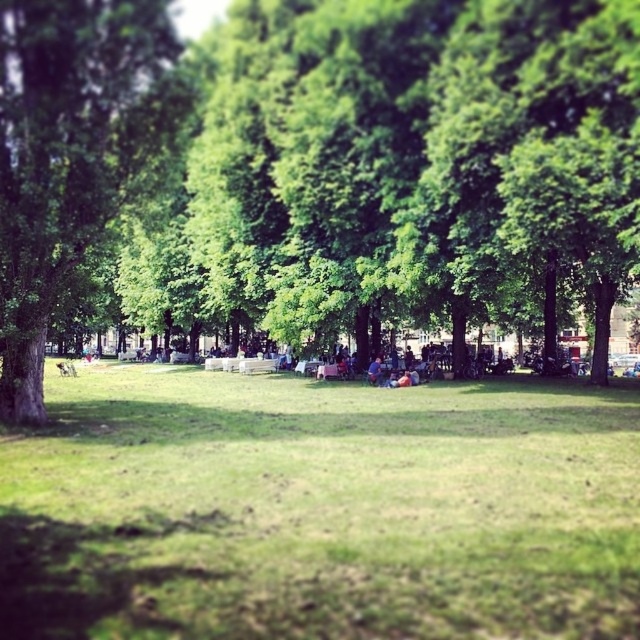
Question: Does green grassy field at center have a larger size compared to green leafy tree at left?

Choices:
 (A) no
 (B) yes

Answer: (B)

Question: Which point is closer to the camera?

Choices:
 (A) tap(250, 364)
 (B) tap(253, 20)
 (C) tap(209, 362)

Answer: (B)

Question: Does green grassy field at center come behind green leafy tree at left?

Choices:
 (A) no
 (B) yes

Answer: (A)

Question: Is green leafy tree at left smaller than white plastic bench at center?

Choices:
 (A) yes
 (B) no

Answer: (A)

Question: Estimate the real-world distances between objects in this image. Which object is farther from the green grassy field at center?

Choices:
 (A) green leafy tree at left
 (B) white wooden bench at center
 (C) white plastic bench at center

Answer: (B)

Question: Estimate the real-world distances between objects in this image. Which object is farther from the white plastic bench at center?

Choices:
 (A) green leafy tree at left
 (B) green leafy tree at center
 (C) white wooden bench at center

Answer: (A)